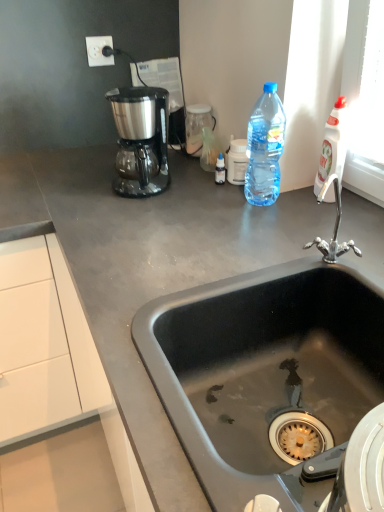
The image size is (384, 512). I want to click on vacant area on the back side of satin black coffee maker at upper left, so click(167, 166).